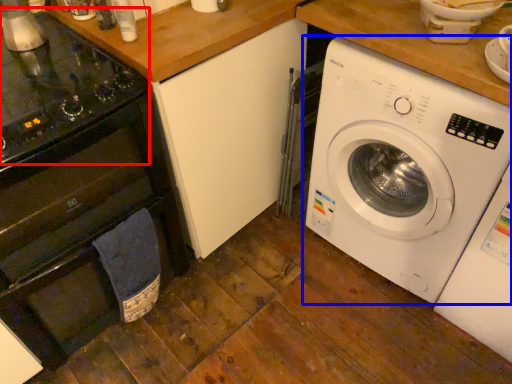
Question: Which of the following is the farthest to the observer, gas stove (highlighted by a red box) or washing machine (highlighted by a blue box)?

Choices:
 (A) gas stove
 (B) washing machine

Answer: (B)